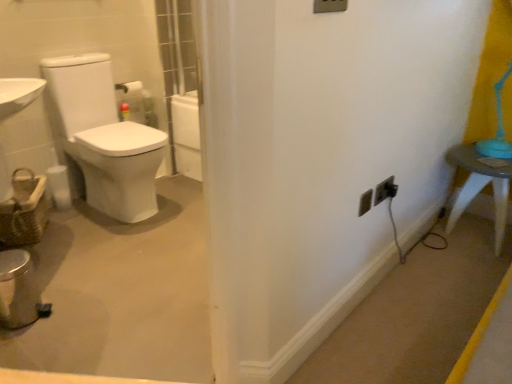
Question: Is woven brown basket at left bigger than white plastic table at right?

Choices:
 (A) yes
 (B) no

Answer: (B)

Question: Is woven brown basket at left not inside white plastic table at right?

Choices:
 (A) no
 (B) yes

Answer: (B)

Question: Considering the relative sizes of woven brown basket at left and white plastic table at right in the image provided, is woven brown basket at left shorter than white plastic table at right?

Choices:
 (A) no
 (B) yes

Answer: (B)

Question: Is woven brown basket at left looking in the opposite direction of white plastic table at right?

Choices:
 (A) yes
 (B) no

Answer: (B)

Question: Is woven brown basket at left in contact with white plastic table at right?

Choices:
 (A) no
 (B) yes

Answer: (A)

Question: Is woven brown basket at left in front of or behind black plastic outlet at lower right, which is counted as the 1th electric outlet, starting from the right, in the image?

Choices:
 (A) front
 (B) behind

Answer: (B)

Question: Is woven brown basket at left taller or shorter than black plastic outlet at lower right, which is counted as the 1th electric outlet, starting from the right?

Choices:
 (A) tall
 (B) short

Answer: (A)

Question: In terms of width, does woven brown basket at left look wider or thinner when compared to black plastic outlet at lower right, which is counted as the 1th electric outlet, starting from the right?

Choices:
 (A) wide
 (B) thin

Answer: (A)

Question: Is point (24, 188) closer or farther from the camera than point (386, 195)?

Choices:
 (A) closer
 (B) farther

Answer: (B)

Question: Is white plastic outlet at lower right, which appears as the third electric outlet when viewed from the right, in front of or behind white plastic table at right in the image?

Choices:
 (A) front
 (B) behind

Answer: (A)

Question: From a real-world perspective, is white plastic outlet at lower right, the first electric outlet when ordered from left to right, physically located above or below white plastic table at right?

Choices:
 (A) above
 (B) below

Answer: (A)

Question: From the image's perspective, is white plastic outlet at lower right, which appears as the third electric outlet when viewed from the right, above or below white plastic table at right?

Choices:
 (A) below
 (B) above

Answer: (A)

Question: Is white plastic outlet at lower right, the first electric outlet when ordered from left to right, spatially inside white plastic table at right, or outside of it?

Choices:
 (A) inside
 (B) outside

Answer: (B)

Question: From a real-world perspective, relative to white plastic outlet at lower right, the first electric outlet when ordered from left to right, is white glossy toilet at left vertically above or below?

Choices:
 (A) above
 (B) below

Answer: (B)

Question: Is white glossy toilet at left in front of or behind white plastic outlet at lower right, the first electric outlet when ordered from left to right, in the image?

Choices:
 (A) behind
 (B) front

Answer: (A)